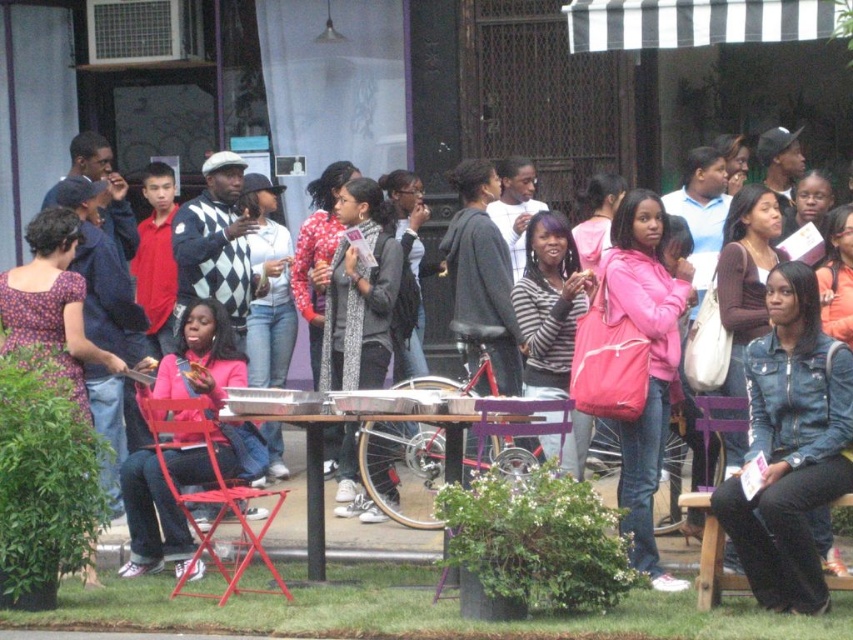
Who is higher up, pink fabric backpack at center or purple wood chair at center?

pink fabric backpack at center is higher up.

This screenshot has width=853, height=640. In order to click on pink fabric backpack at center in this screenshot , I will do pos(207,257).

Image resolution: width=853 pixels, height=640 pixels. I want to click on pink fabric backpack at center, so click(207, 257).

Can you confirm if patterned scarf at center is positioned to the right of purple wood chair at center?

No, patterned scarf at center is not to the right of purple wood chair at center.

Who is positioned more to the left, patterned scarf at center or purple wood chair at center?

patterned scarf at center

Locate an element on the screen. The width and height of the screenshot is (853, 640). patterned scarf at center is located at coordinates (358, 292).

Between patterned scarf at center and wooden table at center, which one is positioned lower?

wooden table at center

Between patterned scarf at center and wooden table at center, which one has more height?

Standing taller between the two is patterned scarf at center.

At what (x,y) coordinates should I click in order to perform the action: click on patterned scarf at center. Please return your answer as a coordinate pair (x, y). Looking at the image, I should click on (x=358, y=292).